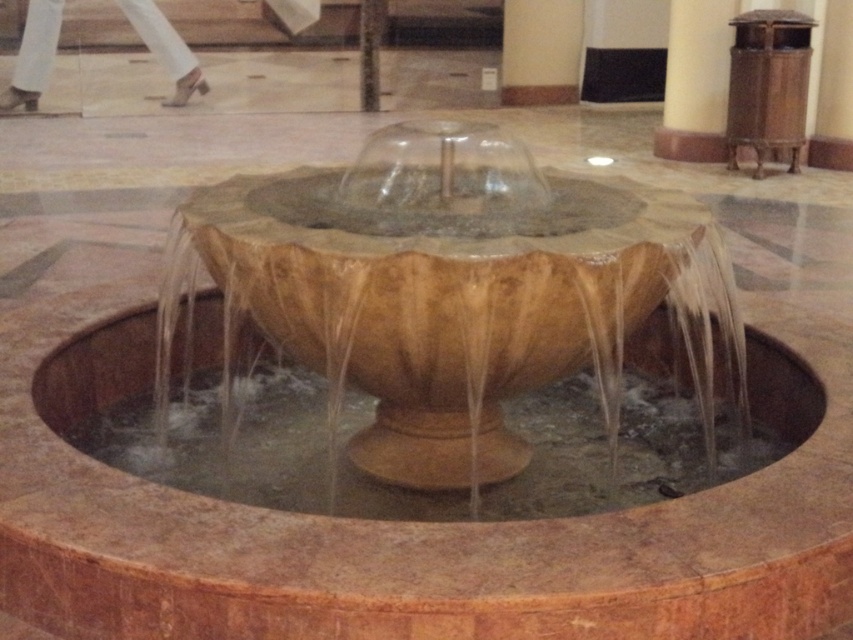
Does brown stone fountain at center have a larger size compared to smooth beige pillar at upper center?

Correct, brown stone fountain at center is larger in size than smooth beige pillar at upper center.

Can you confirm if brown stone fountain at center is shorter than smooth beige pillar at upper center?

Yes.

Where is `brown stone fountain at center`? The width and height of the screenshot is (853, 640). brown stone fountain at center is located at coordinates (454, 301).

Does brown stone fountain at center have a lesser width compared to translucent water at center?

Indeed, brown stone fountain at center has a lesser width compared to translucent water at center.

Can you confirm if brown stone fountain at center is positioned above translucent water at center?

Indeed, brown stone fountain at center is positioned over translucent water at center.

Between point (691, 340) and point (631, 460), which one is positioned behind?

The point (691, 340) is more distant.

This screenshot has height=640, width=853. In order to click on brown stone fountain at center in this screenshot , I will do 454,301.

Does brown stone fountain at center appear under smooth stone pillar at center?

Yes, brown stone fountain at center is below smooth stone pillar at center.

Measure the distance between brown stone fountain at center and smooth stone pillar at center.

→ The distance of brown stone fountain at center from smooth stone pillar at center is 9.24 meters.

Is point (399, 220) positioned behind point (375, 102)?

No.

Find the location of a particular element. This screenshot has width=853, height=640. brown stone fountain at center is located at coordinates (454, 301).